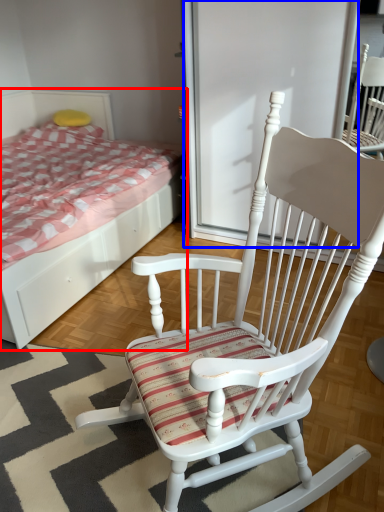
Question: Which object appears farthest to the camera in this image, bed (highlighted by a red box) or screen door (highlighted by a blue box)?

Choices:
 (A) bed
 (B) screen door

Answer: (B)